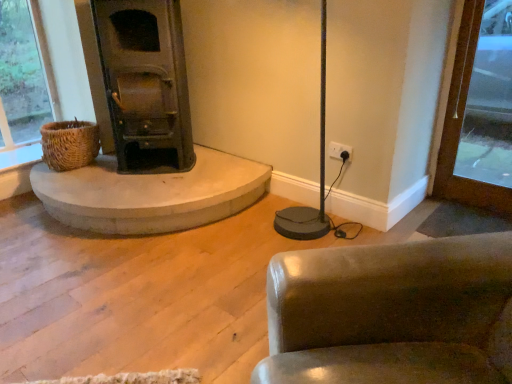
Question: Is dark green metal wood burning stove at left oriented towards leather-like brown chair at lower right?

Choices:
 (A) yes
 (B) no

Answer: (A)

Question: Does dark green metal wood burning stove at left have a lesser width compared to leather-like brown chair at lower right?

Choices:
 (A) no
 (B) yes

Answer: (B)

Question: From the image's perspective, is dark green metal wood burning stove at left located above leather-like brown chair at lower right?

Choices:
 (A) no
 (B) yes

Answer: (B)

Question: Does dark green metal wood burning stove at left come in front of leather-like brown chair at lower right?

Choices:
 (A) no
 (B) yes

Answer: (A)

Question: Is dark green metal wood burning stove at left not near leather-like brown chair at lower right?

Choices:
 (A) no
 (B) yes

Answer: (B)

Question: Considering the relative positions of dark green metal wood burning stove at left and leather-like brown chair at lower right in the image provided, is dark green metal wood burning stove at left to the right of leather-like brown chair at lower right from the viewer's perspective?

Choices:
 (A) no
 (B) yes

Answer: (A)

Question: Does brown wood door at right touch dark green metal wood burning stove at left?

Choices:
 (A) yes
 (B) no

Answer: (B)

Question: Is brown wood door at right wider than dark green metal wood burning stove at left?

Choices:
 (A) yes
 (B) no

Answer: (B)

Question: Considering the relative sizes of brown wood door at right and dark green metal wood burning stove at left in the image provided, is brown wood door at right bigger than dark green metal wood burning stove at left?

Choices:
 (A) no
 (B) yes

Answer: (A)

Question: From a real-world perspective, is brown wood door at right positioned over dark green metal wood burning stove at left based on gravity?

Choices:
 (A) no
 (B) yes

Answer: (A)

Question: Is brown wood door at right not within dark green metal wood burning stove at left?

Choices:
 (A) yes
 (B) no

Answer: (A)

Question: Can you confirm if brown wood door at right is thinner than dark green metal wood burning stove at left?

Choices:
 (A) yes
 (B) no

Answer: (A)

Question: Are leather-like brown chair at lower right and dark green metal wood burning stove at left beside each other?

Choices:
 (A) yes
 (B) no

Answer: (B)